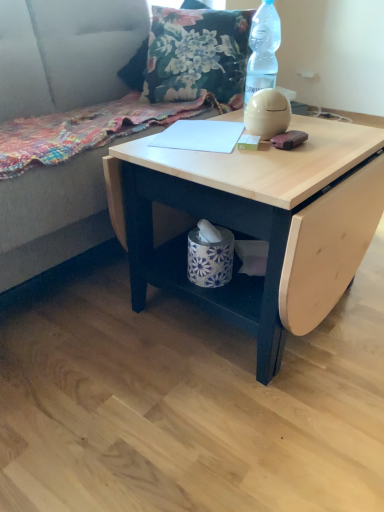
Question: Is transparent plastic bottle at upper right further to the viewer compared to white paper at center?

Choices:
 (A) no
 (B) yes

Answer: (B)

Question: Considering the relative sizes of transparent plastic bottle at upper right and white paper at center in the image provided, is transparent plastic bottle at upper right bigger than white paper at center?

Choices:
 (A) yes
 (B) no

Answer: (A)

Question: Can you confirm if transparent plastic bottle at upper right is taller than white paper at center?

Choices:
 (A) no
 (B) yes

Answer: (B)

Question: Is transparent plastic bottle at upper right oriented away from white paper at center?

Choices:
 (A) no
 (B) yes

Answer: (A)

Question: Does transparent plastic bottle at upper right have a greater width compared to white paper at center?

Choices:
 (A) no
 (B) yes

Answer: (A)

Question: From the image's perspective, is suede gray couch at upper left positioned above or below transparent plastic bottle at upper right?

Choices:
 (A) above
 (B) below

Answer: (B)

Question: Considering the relative positions of suede gray couch at upper left and transparent plastic bottle at upper right in the image provided, is suede gray couch at upper left to the left or to the right of transparent plastic bottle at upper right?

Choices:
 (A) right
 (B) left

Answer: (B)

Question: Is suede gray couch at upper left in front of or behind transparent plastic bottle at upper right in the image?

Choices:
 (A) behind
 (B) front

Answer: (B)

Question: Is suede gray couch at upper left bigger or smaller than transparent plastic bottle at upper right?

Choices:
 (A) big
 (B) small

Answer: (A)

Question: From the image's perspective, is white paper at center above or below light wood table at center?

Choices:
 (A) above
 (B) below

Answer: (A)

Question: Do you think white paper at center is within light wood table at center, or outside of it?

Choices:
 (A) inside
 (B) outside

Answer: (A)

Question: Looking at the image, does white paper at center seem bigger or smaller compared to light wood table at center?

Choices:
 (A) small
 (B) big

Answer: (A)

Question: From a real-world perspective, is white paper at center above or below light wood table at center?

Choices:
 (A) below
 (B) above

Answer: (B)

Question: In terms of size, does floral fabric pillow at upper center appear bigger or smaller than suede gray couch at upper left?

Choices:
 (A) big
 (B) small

Answer: (B)

Question: Is floral fabric pillow at upper center situated inside suede gray couch at upper left or outside?

Choices:
 (A) outside
 (B) inside

Answer: (B)